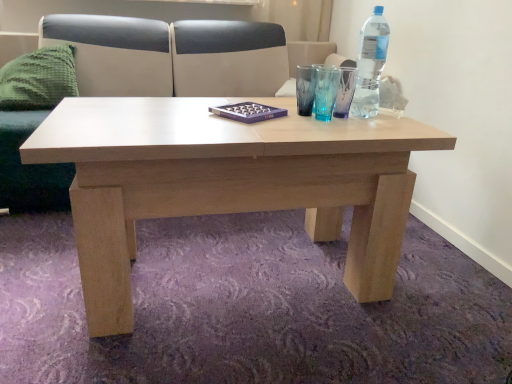
Question: Relative to clear plastic bottle at upper right, is green knitted pillow at left in front or behind?

Choices:
 (A) behind
 (B) front

Answer: (A)

Question: In terms of height, does green knitted pillow at left look taller or shorter compared to clear plastic bottle at upper right?

Choices:
 (A) short
 (B) tall

Answer: (A)

Question: Estimate the real-world distances between objects in this image. Which object is farther from the clear plastic bottle at upper right?

Choices:
 (A) green knitted pillow at left
 (B) light beige leather couch at upper center

Answer: (A)

Question: Which object is positioned farthest from the light beige leather couch at upper center?

Choices:
 (A) clear plastic bottle at upper right
 (B) green knitted pillow at left

Answer: (A)